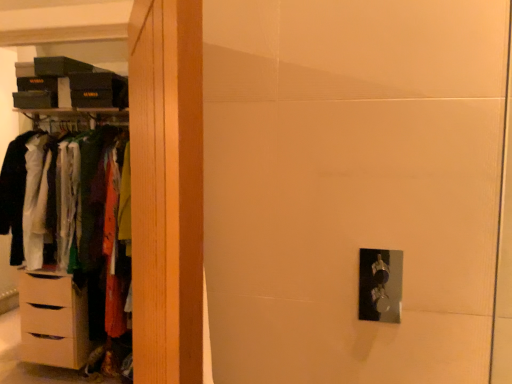
Question: From their relative heights in the image, would you say matte wood dresser at left is taller or shorter than beige matte chest of drawers at left?

Choices:
 (A) short
 (B) tall

Answer: (B)

Question: Considering their positions, is matte wood dresser at left located in front of or behind beige matte chest of drawers at left?

Choices:
 (A) behind
 (B) front

Answer: (B)

Question: Which of these objects is positioned farthest from the beige matte chest of drawers at left?

Choices:
 (A) matte wood dresser at left
 (B) wooden wardrobe at left

Answer: (B)

Question: Estimate the real-world distances between objects in this image. Which object is farther from the wooden wardrobe at left?

Choices:
 (A) beige matte chest of drawers at left
 (B) matte wood dresser at left

Answer: (B)